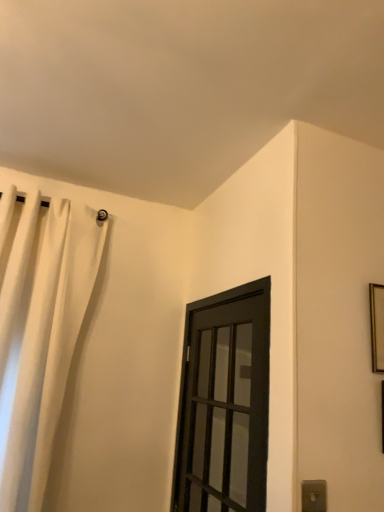
Question: Does gray plastic electric outlet at lower right have a lesser height compared to black matte door at center?

Choices:
 (A) yes
 (B) no

Answer: (A)

Question: Considering the relative sizes of gray plastic electric outlet at lower right and black matte door at center in the image provided, is gray plastic electric outlet at lower right smaller than black matte door at center?

Choices:
 (A) yes
 (B) no

Answer: (A)

Question: From the image's perspective, is gray plastic electric outlet at lower right located above black matte door at center?

Choices:
 (A) yes
 (B) no

Answer: (B)

Question: Is gray plastic electric outlet at lower right positioned with its back to black matte door at center?

Choices:
 (A) yes
 (B) no

Answer: (A)

Question: Is gray plastic electric outlet at lower right to the left of black matte door at center from the viewer's perspective?

Choices:
 (A) yes
 (B) no

Answer: (B)

Question: Does gray plastic electric outlet at lower right appear on the right side of black matte door at center?

Choices:
 (A) no
 (B) yes

Answer: (B)

Question: Would you say gray plastic electric outlet at lower right is outside gold metallic picture frame at upper right?

Choices:
 (A) yes
 (B) no

Answer: (A)

Question: From a real-world perspective, is gray plastic electric outlet at lower right located higher than gold metallic picture frame at upper right?

Choices:
 (A) yes
 (B) no

Answer: (B)

Question: Is gray plastic electric outlet at lower right looking in the opposite direction of gold metallic picture frame at upper right?

Choices:
 (A) no
 (B) yes

Answer: (A)

Question: Does gray plastic electric outlet at lower right contain gold metallic picture frame at upper right?

Choices:
 (A) no
 (B) yes

Answer: (A)

Question: Can you confirm if gray plastic electric outlet at lower right is thinner than gold metallic picture frame at upper right?

Choices:
 (A) no
 (B) yes

Answer: (B)

Question: Is gray plastic electric outlet at lower right smaller than gold metallic picture frame at upper right?

Choices:
 (A) no
 (B) yes

Answer: (B)

Question: Is gold metallic picture frame at upper right aimed at white fabric curtain at upper left?

Choices:
 (A) no
 (B) yes

Answer: (A)